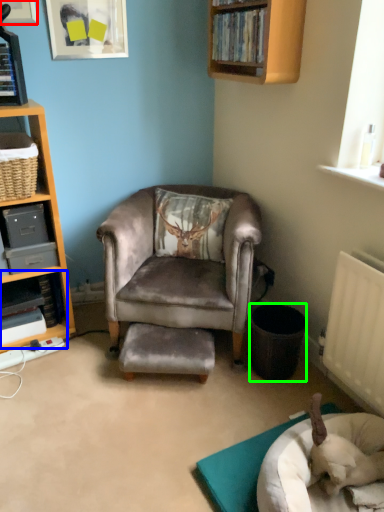
Question: Which object is positioned farthest from shelf in the corner of a room with a picture frame on the wall (highlighted by a red box)? Select from shelf (highlighted by a blue box) and trash bin/can (highlighted by a green box).

Choices:
 (A) shelf
 (B) trash bin/can

Answer: (B)